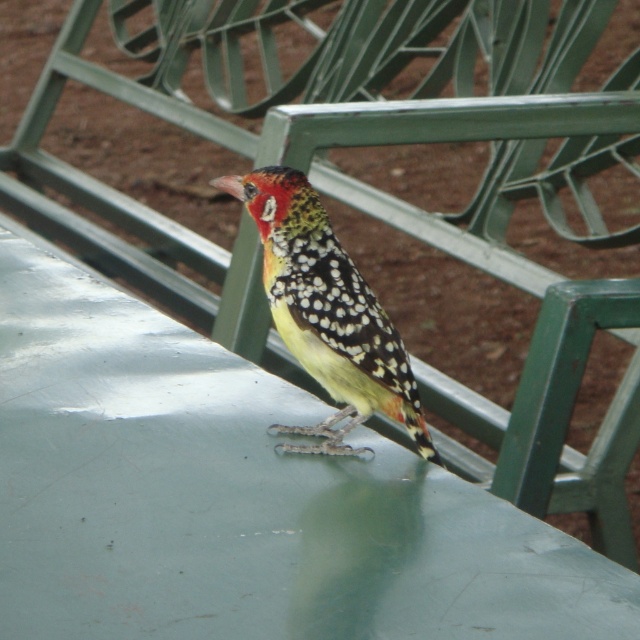
You are trying to place a small decorative item that is 10 cm wide on the green matte table at center. The speckled feathered bird at center is currently sitting on the table. Can the bird stay on the table while the item is placed there?

The green matte table at center might be wider than the speckled feathered bird at center, so there might be enough space for both the bird and the decorative item. However, since the exact dimensions aren

You are standing in a park and see two points marked on the ground. The first point is at coordinates point (285, 538) and the second point is at coordinates point (257, 196). If you walk towards the direction where the bird is facing, which point will you reach first?

Point (285, 538) is in front of point (257, 196), so you will reach point (285, 538) first when walking towards the direction the bird is facing.